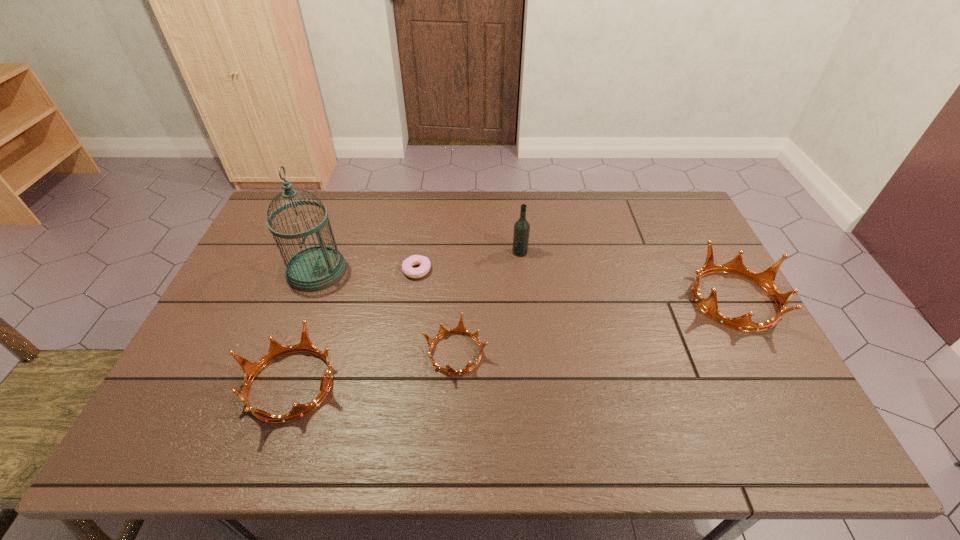
Where is `vacant space at the far edge of the desktop`? This screenshot has width=960, height=540. vacant space at the far edge of the desktop is located at coordinates (612, 200).

In the image, there is a desktop. Where is `vacant space at the near edge`? vacant space at the near edge is located at coordinates (612, 379).

Locate an element on the screen. vacant space at the left edge of the desktop is located at coordinates (274, 287).

At what (x,y) coordinates should I click in order to perform the action: click on vacant space at the right edge of the desktop. Please return your answer as a coordinate pair (x, y). Looking at the image, I should click on pos(678,288).

Where is `free space at the far left corner of the desktop`? free space at the far left corner of the desktop is located at coordinates (301, 226).

This screenshot has width=960, height=540. What are the coordinates of `vacant space at the far right corner of the desktop` in the screenshot? It's located at (683, 217).

Find the location of a particular element. Image resolution: width=960 pixels, height=540 pixels. vacant space in between the fourth object from right to left and the rightmost object is located at coordinates (576, 285).

Find the location of a particular element. Image resolution: width=960 pixels, height=540 pixels. free space between the second shortest crown and the second tallest object is located at coordinates (405, 318).

Where is `vacant space that is in between the leftmost crown and the fourth object from right to left`? vacant space that is in between the leftmost crown and the fourth object from right to left is located at coordinates (353, 327).

The height and width of the screenshot is (540, 960). I want to click on free space between the shortest object and the second crown from right to left, so click(436, 312).